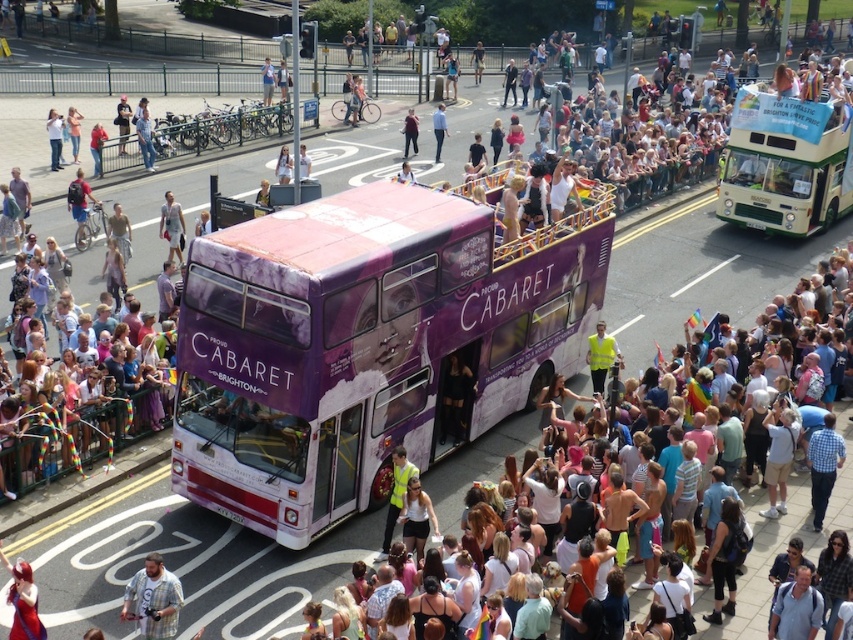
Question: Can you confirm if purple matte/decorative bus at center is wider than matte purple bus at center?

Choices:
 (A) yes
 (B) no

Answer: (A)

Question: Is purple matte/decorative bus at center below matte purple bus at center?

Choices:
 (A) yes
 (B) no

Answer: (A)

Question: Is purple matte bus at center in front of matte purple bus at center?

Choices:
 (A) no
 (B) yes

Answer: (B)

Question: Which is farther from the matte purple bus at center?

Choices:
 (A) plaid shirt at lower left
 (B) purple matte bus at center
 (C) purple matte/decorative bus at center
 (D) green metallic bus at upper right

Answer: (A)

Question: Considering the real-world distances, which object is closest to the purple matte/decorative bus at center?

Choices:
 (A) purple matte bus at center
 (B) plaid shirt at lower left
 (C) green metallic bus at upper right

Answer: (A)

Question: Which is farther from the green metallic bus at upper right?

Choices:
 (A) purple matte/decorative bus at center
 (B) plaid shirt at lower left

Answer: (B)